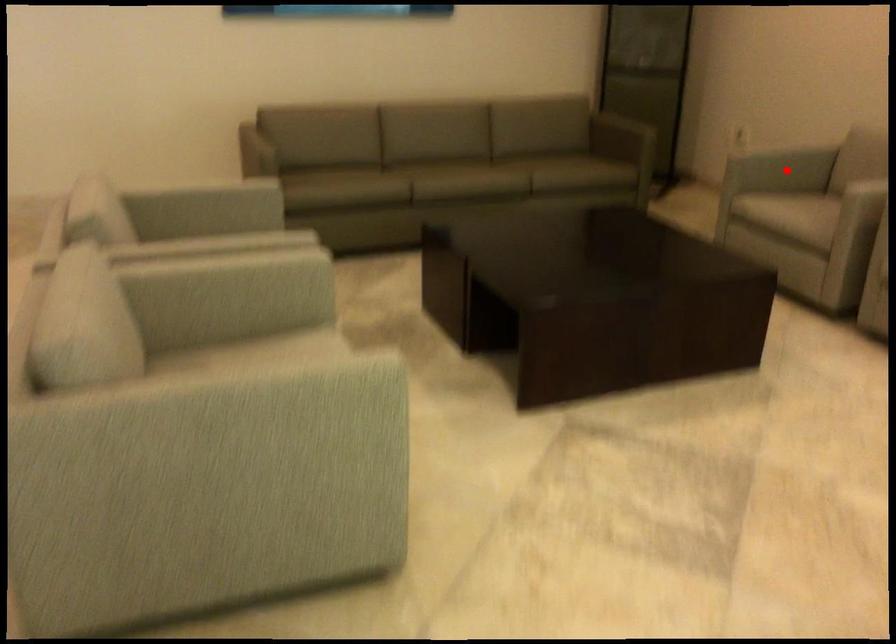
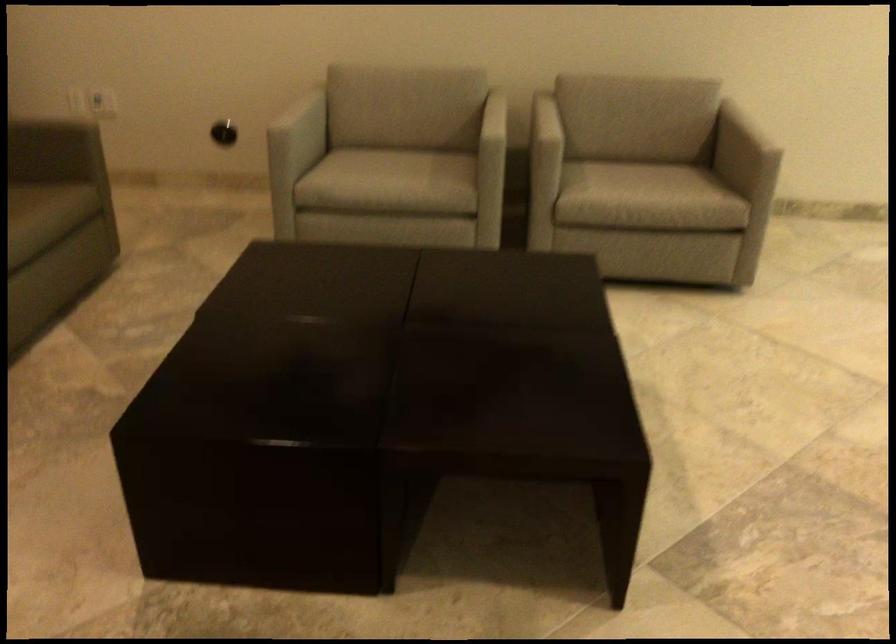
Question: A red point is marked in image1. In image2, is the corresponding 3D point closer to the camera or farther? Reply with the corresponding letter.

Choices:
 (A) The corresponding 3D point is closer.
 (B) The corresponding 3D point is farther.

Answer: (A)